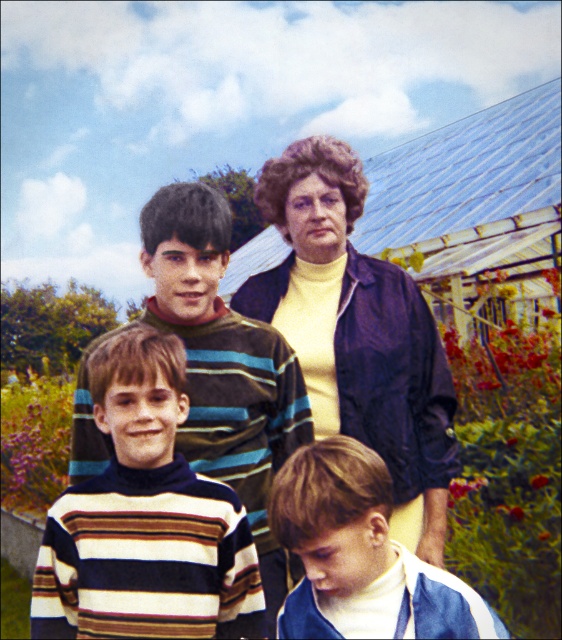
Question: Is striped turtleneck sweater at center to the right of matte yellow sweater at center from the viewer's perspective?

Choices:
 (A) yes
 (B) no

Answer: (B)

Question: Observing the image, what is the correct spatial positioning of matte yellow sweater at center in reference to striped sweater at lower center?

Choices:
 (A) right
 (B) left

Answer: (A)

Question: Which object is the closest to the striped sweater at lower center?

Choices:
 (A) striped turtleneck sweater at center
 (B) matte yellow sweater at center

Answer: (A)

Question: Which of the following is the closest to the observer?

Choices:
 (A) (446, 620)
 (B) (370, 282)
 (C) (115, 572)

Answer: (A)

Question: Can you confirm if striped turtleneck sweater at center is positioned below matte yellow sweater at center?

Choices:
 (A) no
 (B) yes

Answer: (B)

Question: Among these objects, which one is nearest to the camera?

Choices:
 (A) striped turtleneck sweater at center
 (B) matte yellow sweater at center
 (C) striped sweater at lower center

Answer: (C)